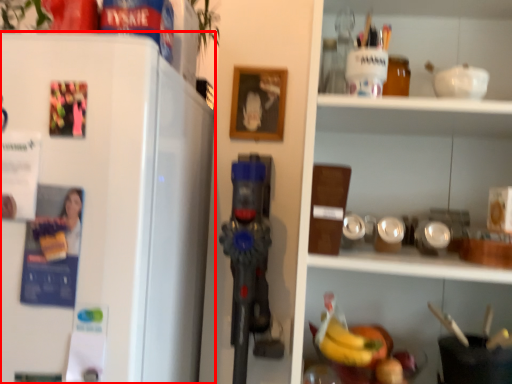
Question: From the image's perspective, where is refrigerator (annotated by the red box) located relative to shelf?

Choices:
 (A) below
 (B) above

Answer: (B)